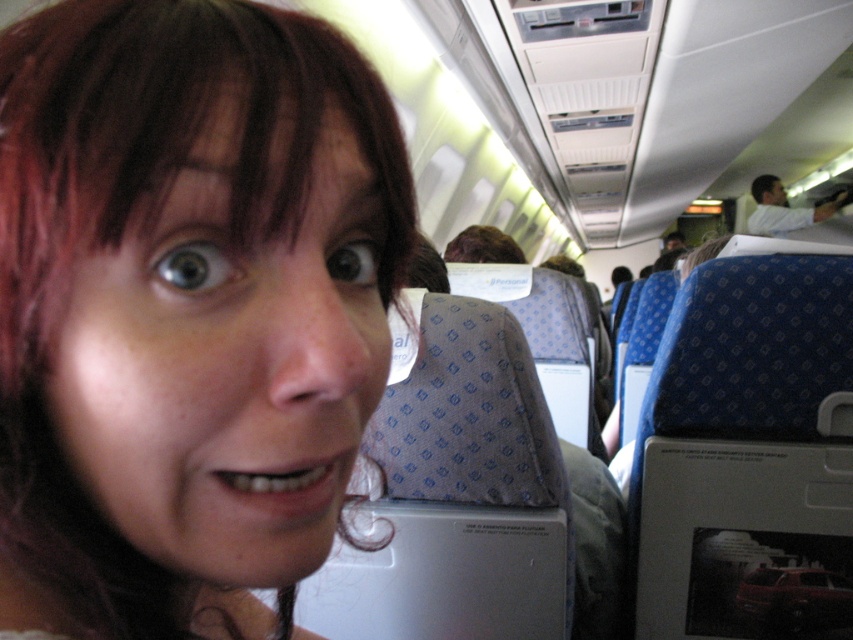
You are a photographer trying to capture the matte skin face at center and the matte white shirt at upper right in a single shot. Based on their positions, which object should you adjust your camera focus to first to ensure both are in frame?

The matte skin face at center is positioned on the left side of matte white shirt at upper right. To ensure both are in frame, focus on the matte skin face at center first as it is closer to the center of the image, then adjust the camera angle slightly to include the matte white shirt at upper right in the upper right quadrant.

You are a photographer trying to capture the best selfie possible. You notice the matte skin face at center and the brown fuzzy hair at center in your frame. Based on their sizes in the image, which object should you adjust your focus on to ensure both are clear?

The matte skin face at center is much taller than the brown fuzzy hair at center, so you should focus on the matte skin face at center to ensure clarity since it occupies more space in the frame.

You are a photographer trying to capture the best shot of the matte skin face at center and the brown fuzzy hair at center. Since you want to focus on the face, which object should you adjust your camera to prioritize in terms of depth of field?

The matte skin face at center is closer to the viewer than the brown fuzzy hair at center, so you should adjust your camera to prioritize the matte skin face at center for optimal focus.